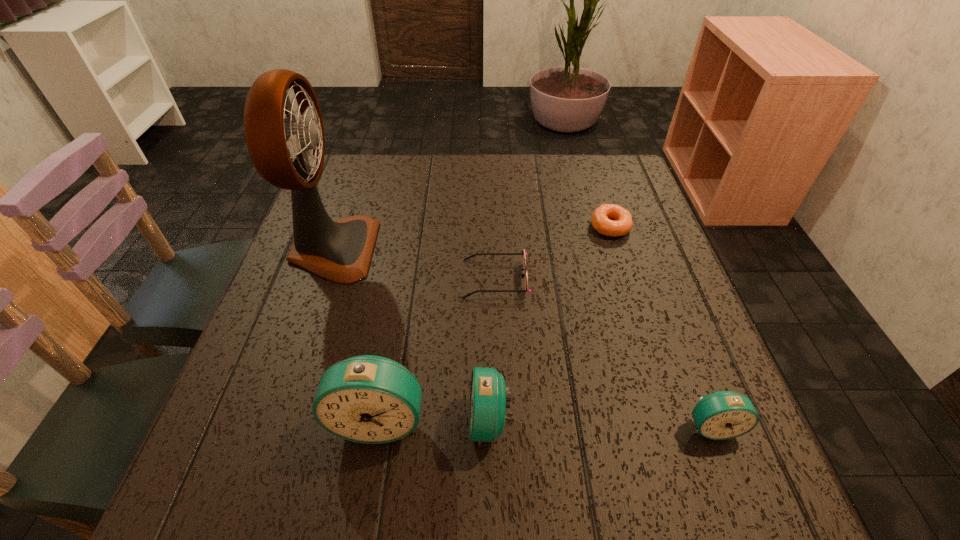
Where is `object that ranks as the closest to the third tallest object`? object that ranks as the closest to the third tallest object is located at coordinates (368, 399).

Locate which alarm clock is the closest to the leftmost object. Please provide its 2D coordinates. Your answer should be formatted as a tuple, i.e. [(x, y)], where the tuple contains the x and y coordinates of a point satisfying the conditions above.

[(368, 399)]

You are a GUI agent. You are given a task and a screenshot of the screen. Output one action in this format:
    pyautogui.click(x=<x>, y=<y>)
    Task: Click on the third closest alarm clock to the sunglasses
    The image size is (960, 540).
    Given the screenshot: What is the action you would take?
    pyautogui.click(x=722, y=415)